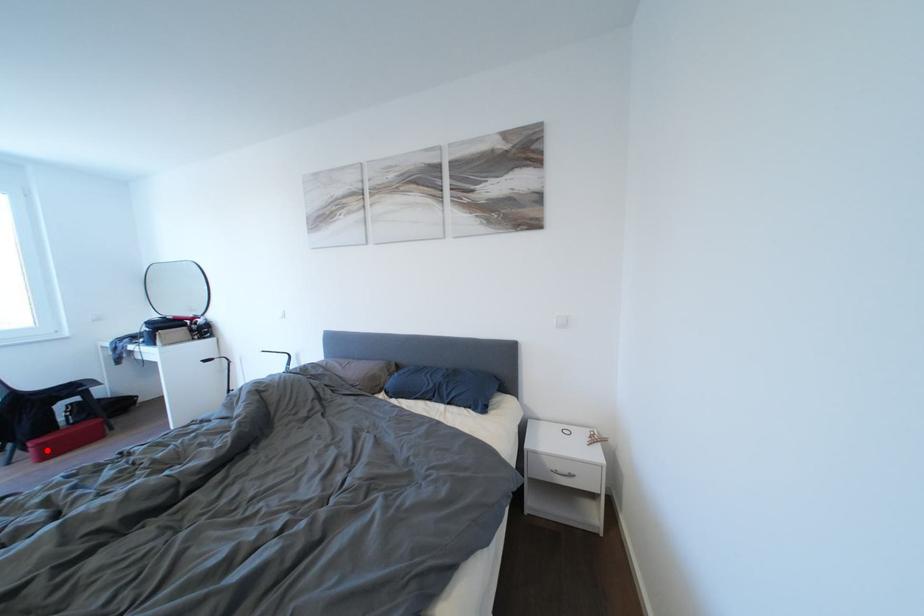
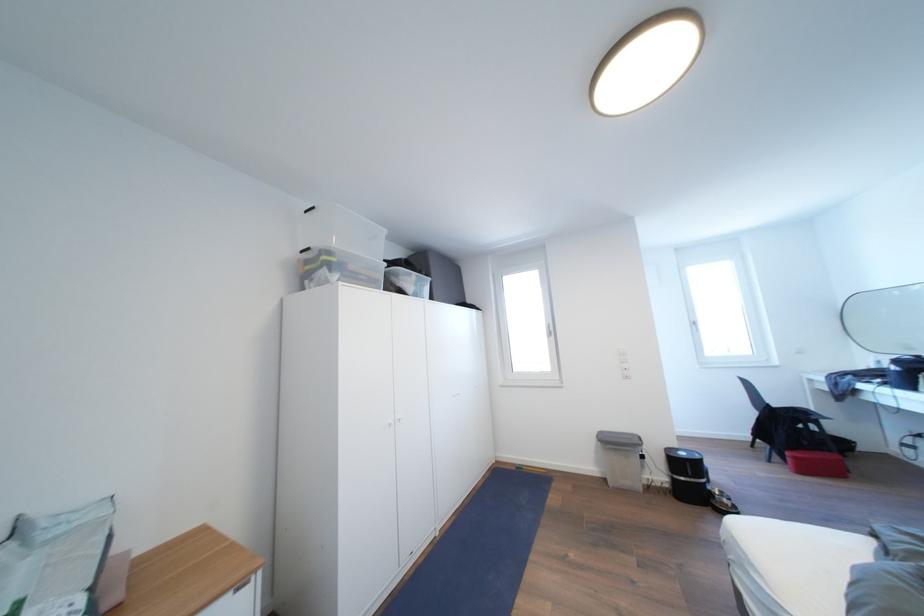
Question: I am providing you with two images of the same scene from different viewpoints. Given a red point in image1, look at the same physical point in image2. Is it:

Choices:
 (A) Closer to the viewpoint
 (B) Farther from the viewpoint

Answer: (B)